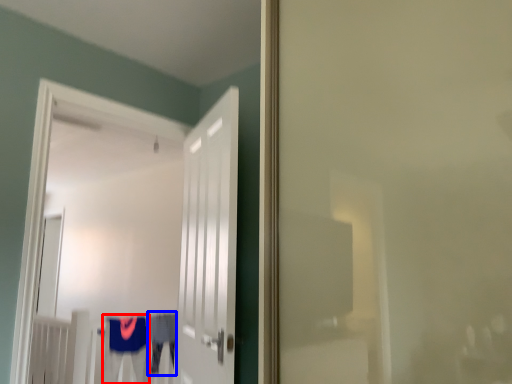
Question: Which object appears closest to the camera in this image, robe (highlighted by a red box) or robe (highlighted by a blue box)?

Choices:
 (A) robe
 (B) robe

Answer: (A)